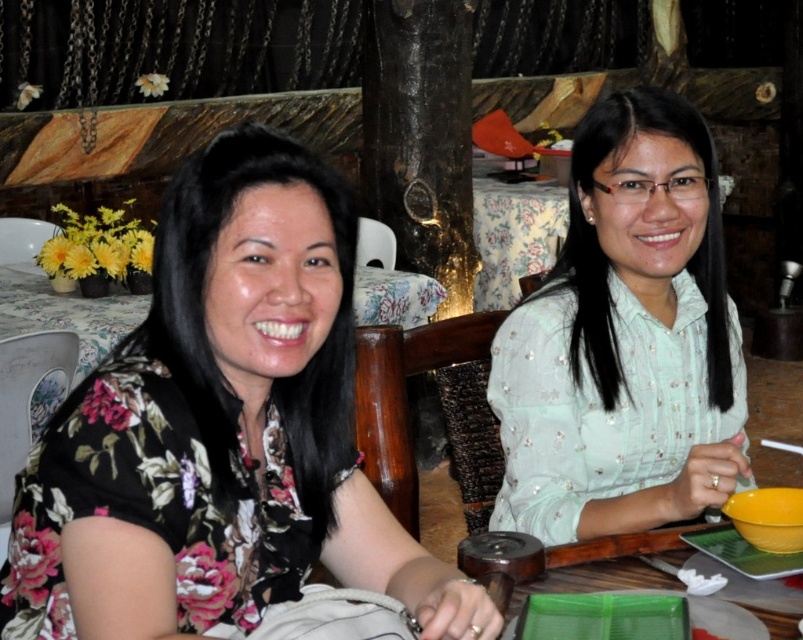
Can you confirm if green plastic tray at lower right is thinner than yellow matte bowl at lower right?

No.

At what (x,y) coordinates should I click in order to perform the action: click on green plastic tray at lower right. Please return your answer as a coordinate pair (x, y). The width and height of the screenshot is (803, 640). Looking at the image, I should click on (610, 563).

Between floral print blouse at left and yellow matte bowl at lower right, which one appears on the left side from the viewer's perspective?

floral print blouse at left

In the scene shown: Which is more to the right, floral print blouse at left or yellow matte bowl at lower right?

yellow matte bowl at lower right

Is point (182, 378) less distant than point (779, 497)?

Yes, point (182, 378) is in front of point (779, 497).

Where is `floral print blouse at left`? floral print blouse at left is located at coordinates (221, 432).

Between floral print blouse at left and light green fabric shirt at center, which one is positioned higher?

Positioned higher is light green fabric shirt at center.

Find the location of a particular element. floral print blouse at left is located at coordinates (221, 432).

Is point (249, 323) in front of point (628, 147)?

Yes, point (249, 323) is in front of point (628, 147).

I want to click on floral print blouse at left, so click(221, 432).